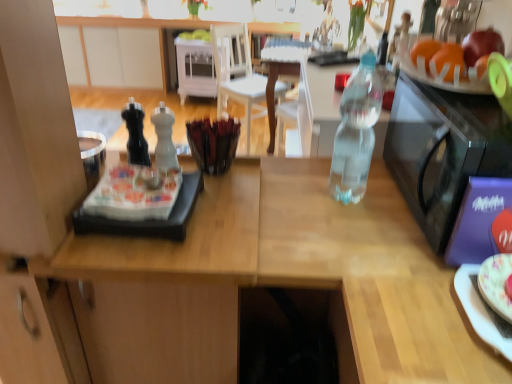
What do you see at coordinates (195, 68) in the screenshot?
I see `white wood cabinet at center, positioned as the first cabinetry in right-to-left order` at bounding box center [195, 68].

This screenshot has height=384, width=512. Describe the element at coordinates (136, 134) in the screenshot. I see `black glass pepper shaker at left, positioned as the first bottle in left-to-right order` at that location.

Describe the element at coordinates (455, 53) in the screenshot. The width and height of the screenshot is (512, 384). I see `shiny red apple at upper right` at that location.

What do you see at coordinates (448, 60) in the screenshot? Image resolution: width=512 pixels, height=384 pixels. I see `orange matte at upper right, acting as the 1th orange starting from the front` at bounding box center [448, 60].

Where is `white wood chair at center`? This screenshot has width=512, height=384. white wood chair at center is located at coordinates (239, 72).

Identify the location of orange matte at upper right, which ranks as the 2th orange in front-to-back order. The height and width of the screenshot is (384, 512). (425, 51).

Find the location of a particular element. This screenshot has height=384, width=512. clear plastic bottle at center, acting as the 1th bottle starting from the right is located at coordinates (356, 132).

Considering the relative positions of porcelain floral plate at right and white matte cabinet at upper left, the first cabinetry positioned from the left, in the image provided, is porcelain floral plate at right to the left of white matte cabinet at upper left, the first cabinetry positioned from the left, from the viewer's perspective?

In fact, porcelain floral plate at right is to the right of white matte cabinet at upper left, the first cabinetry positioned from the left.

Considering the points (467, 265) and (90, 49), which point is behind, point (467, 265) or point (90, 49)?

The point (90, 49) is farther.

Who is taller, porcelain floral plate at right or white matte cabinet at upper left, marked as the second cabinetry in a right-to-left arrangement?

white matte cabinet at upper left, marked as the second cabinetry in a right-to-left arrangement.

Considering the positions of objects porcelain floral plate at right and white matte cabinet at upper left, marked as the second cabinetry in a right-to-left arrangement, in the image provided, who is behind, porcelain floral plate at right or white matte cabinet at upper left, marked as the second cabinetry in a right-to-left arrangement,?

white matte cabinet at upper left, marked as the second cabinetry in a right-to-left arrangement.

From a real-world perspective, is black glass pepper shaker at left, positioned as the first bottle in left-to-right order, positioned above or below shiny red apple at upper right?

black glass pepper shaker at left, positioned as the first bottle in left-to-right order, is below shiny red apple at upper right.

From the image's perspective, relative to shiny red apple at upper right, is black glass pepper shaker at left, positioned as the first bottle in left-to-right order, above or below?

Based on their image positions, black glass pepper shaker at left, positioned as the first bottle in left-to-right order, is located beneath shiny red apple at upper right.

Which is nearer, (130, 158) or (434, 42)?

Positioned in front is point (434, 42).

Can you see orange matte at upper right, acting as the 1th orange starting from the front, touching white matte cabinet at upper left, the first cabinetry positioned from the left?

orange matte at upper right, acting as the 1th orange starting from the front, is not next to white matte cabinet at upper left, the first cabinetry positioned from the left, and they're not touching.

Measure the distance from orange matte at upper right, placed as the second orange when sorted from back to front, to white matte cabinet at upper left, marked as the second cabinetry in a right-to-left arrangement.

A distance of 3.91 meters exists between orange matte at upper right, placed as the second orange when sorted from back to front, and white matte cabinet at upper left, marked as the second cabinetry in a right-to-left arrangement.

Considering the relative sizes of orange matte at upper right, acting as the 1th orange starting from the front, and white matte cabinet at upper left, marked as the second cabinetry in a right-to-left arrangement, in the image provided, is orange matte at upper right, acting as the 1th orange starting from the front, smaller than white matte cabinet at upper left, marked as the second cabinetry in a right-to-left arrangement,?

Correct, orange matte at upper right, acting as the 1th orange starting from the front, occupies less space than white matte cabinet at upper left, marked as the second cabinetry in a right-to-left arrangement.

Would you say orange matte at upper right, placed as the second orange when sorted from back to front, is inside or outside white matte cabinet at upper left, the first cabinetry positioned from the left?

orange matte at upper right, placed as the second orange when sorted from back to front, lies outside white matte cabinet at upper left, the first cabinetry positioned from the left.

In the image, is orange matte at upper right, acting as the 1th orange starting from the front, positioned in front of or behind clear plastic bottle at center, acting as the 1th bottle starting from the right?

In the image, orange matte at upper right, acting as the 1th orange starting from the front, appears behind clear plastic bottle at center, acting as the 1th bottle starting from the right.

Based on the photo, which is farther, (x=436, y=71) or (x=370, y=128)?

Positioned behind is point (x=436, y=71).

From the image's perspective, which is below, orange matte at upper right, acting as the 1th orange starting from the front, or clear plastic bottle at center, which ranks as the 3th bottle in left-to-right order?

clear plastic bottle at center, which ranks as the 3th bottle in left-to-right order, is shown below in the image.

Does orange matte at upper right, acting as the 1th orange starting from the front, appear on the right side of clear plastic bottle at center, acting as the 1th bottle starting from the right?

Correct, you'll find orange matte at upper right, acting as the 1th orange starting from the front, to the right of clear plastic bottle at center, acting as the 1th bottle starting from the right.

Between white wood cabinet at center, positioned as the first cabinetry in right-to-left order, and orange matte at upper right, acting as the 1th orange starting from the front, which one is positioned behind?

white wood cabinet at center, positioned as the first cabinetry in right-to-left order.

Which of these two, white wood cabinet at center, positioned as the first cabinetry in right-to-left order, or orange matte at upper right, acting as the 1th orange starting from the front, is bigger?

With larger size is white wood cabinet at center, positioned as the first cabinetry in right-to-left order.

Does white wood cabinet at center, positioned as the first cabinetry in right-to-left order, have a lesser width compared to orange matte at upper right, placed as the second orange when sorted from back to front?

No.

Considering the positions of point (126, 111) and point (165, 112), is point (126, 111) closer or farther from the camera than point (165, 112)?

Point (126, 111) is farther from the camera than point (165, 112).

Is black glass pepper shaker at left, which is counted as the third bottle, starting from the right, positioned behind white matte pepper shaker at center, the 2th bottle viewed from the left?

Yes, it is.

Is white matte pepper shaker at center, which is the second bottle in right-to-left order, inside black glass pepper shaker at left, positioned as the first bottle in left-to-right order?

No.

Is black glass pepper shaker at left, which is counted as the third bottle, starting from the right, bigger than white matte pepper shaker at center, which is the second bottle in right-to-left order?

Actually, black glass pepper shaker at left, which is counted as the third bottle, starting from the right, might be smaller than white matte pepper shaker at center, which is the second bottle in right-to-left order.

From a real-world perspective, is transparent plastic microwave at right beneath white wood cabinet at center, placed as the 2th cabinetry when sorted from left to right?

Actually, transparent plastic microwave at right is physically above white wood cabinet at center, placed as the 2th cabinetry when sorted from left to right, in the real world.

In the image, is transparent plastic microwave at right positioned in front of or behind white wood cabinet at center, positioned as the first cabinetry in right-to-left order?

transparent plastic microwave at right is in front of white wood cabinet at center, positioned as the first cabinetry in right-to-left order.

Is transparent plastic microwave at right outside of white wood cabinet at center, positioned as the first cabinetry in right-to-left order?

transparent plastic microwave at right is positioned outside white wood cabinet at center, positioned as the first cabinetry in right-to-left order.

Image resolution: width=512 pixels, height=384 pixels. What are the coordinates of `the 2nd cabinetry above the porcelain floral plate at right (from the image's perspective)` in the screenshot? It's located at 112,57.

This screenshot has height=384, width=512. Find the location of `fruit in front of the black glass pepper shaker at left, positioned as the first bottle in left-to-right order`. fruit in front of the black glass pepper shaker at left, positioned as the first bottle in left-to-right order is located at coordinates (455, 53).

Looking at the image, which one is located closer to porcelain floral plate at right, shiny red apple at upper right or transparent plastic microwave at right?

transparent plastic microwave at right is positioned closer to the anchor porcelain floral plate at right.

Looking at this image, from the image, which object appears to be farther from white wood cabinet at center, placed as the 2th cabinetry when sorted from left to right, white matte cabinet at upper left, marked as the second cabinetry in a right-to-left arrangement, or porcelain floral plate at right?

porcelain floral plate at right is positioned further to the anchor white wood cabinet at center, placed as the 2th cabinetry when sorted from left to right.

When comparing their distances from black glass pepper shaker at left, which is counted as the third bottle, starting from the right, does shiny red apple at upper right or white matte pepper shaker at center, the 2th bottle viewed from the left, seem closer?

Based on the image, white matte pepper shaker at center, the 2th bottle viewed from the left, appears to be nearer to black glass pepper shaker at left, which is counted as the third bottle, starting from the right.

Considering their positions, is white matte pepper shaker at center, the 2th bottle viewed from the left, positioned closer to white matte cabinet at upper left, the first cabinetry positioned from the left, than orange matte at upper right, acting as the 1th orange starting from the front?

The object closer to white matte cabinet at upper left, the first cabinetry positioned from the left, is white matte pepper shaker at center, the 2th bottle viewed from the left.

Considering their positions, is black glass pepper shaker at left, positioned as the first bottle in left-to-right order, positioned further to white matte cabinet at upper left, marked as the second cabinetry in a right-to-left arrangement, than orange matte at upper right, placed as the second orange when sorted from back to front?

orange matte at upper right, placed as the second orange when sorted from back to front, lies further to white matte cabinet at upper left, marked as the second cabinetry in a right-to-left arrangement, than the other object.

From the image, which object appears to be nearer to shiny red apple at upper right, white wood cabinet at center, positioned as the first cabinetry in right-to-left order, or orange matte at upper right, which ranks as the 2th orange in front-to-back order?

The object closer to shiny red apple at upper right is orange matte at upper right, which ranks as the 2th orange in front-to-back order.

Estimate the real-world distances between objects in this image. Which object is further from orange matte at upper right, acting as the 1th orange starting from the front, white wood cabinet at center, positioned as the first cabinetry in right-to-left order, or clear plastic bottle at center, acting as the 1th bottle starting from the right?

Among the two, white wood cabinet at center, positioned as the first cabinetry in right-to-left order, is located further to orange matte at upper right, acting as the 1th orange starting from the front.

In the scene shown: Considering their positions, is white wood chair at center positioned closer to white matte cabinet at upper left, marked as the second cabinetry in a right-to-left arrangement, than black glass pepper shaker at left, which is counted as the third bottle, starting from the right?

Among the two, white wood chair at center is located nearer to white matte cabinet at upper left, marked as the second cabinetry in a right-to-left arrangement.

Image resolution: width=512 pixels, height=384 pixels. Find the location of `chair located between shiny red apple at upper right and white wood cabinet at center, placed as the 2th cabinetry when sorted from left to right, in the depth direction`. chair located between shiny red apple at upper right and white wood cabinet at center, placed as the 2th cabinetry when sorted from left to right, in the depth direction is located at coordinates (239, 72).

This screenshot has height=384, width=512. Identify the location of cabinetry between white matte pepper shaker at center, the 2th bottle viewed from the left, and white matte cabinet at upper left, the first cabinetry positioned from the left, along the z-axis. (195, 68).

Where is `orange positioned between orange matte at upper right, acting as the 1th orange starting from the front, and white matte cabinet at upper left, marked as the second cabinetry in a right-to-left arrangement, from near to far`? The width and height of the screenshot is (512, 384). orange positioned between orange matte at upper right, acting as the 1th orange starting from the front, and white matte cabinet at upper left, marked as the second cabinetry in a right-to-left arrangement, from near to far is located at coordinates pos(425,51).

Find the location of `cabinetry located between clear plastic bottle at center, acting as the 1th bottle starting from the right, and white matte cabinet at upper left, the first cabinetry positioned from the left, in the depth direction`. cabinetry located between clear plastic bottle at center, acting as the 1th bottle starting from the right, and white matte cabinet at upper left, the first cabinetry positioned from the left, in the depth direction is located at coordinates (195, 68).